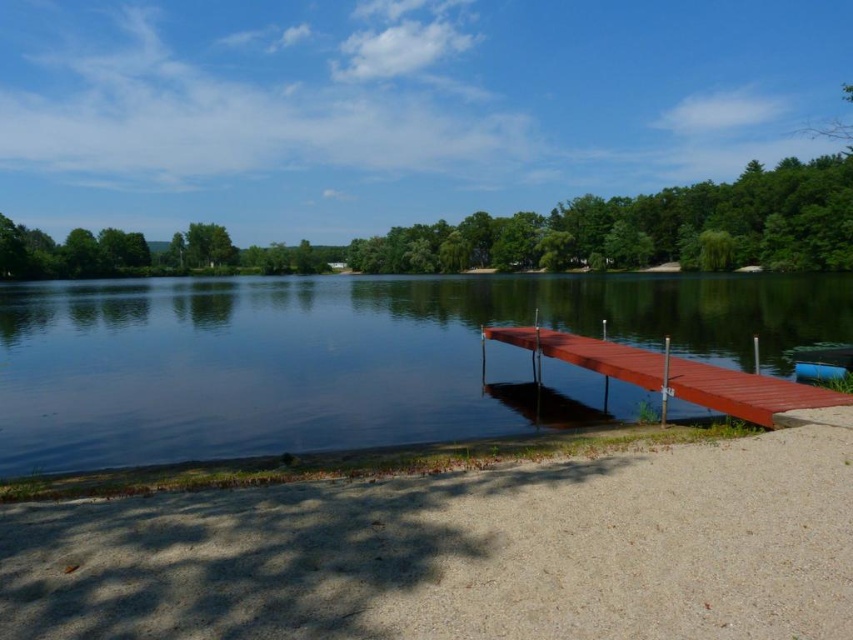
You are planning to place a small picnic basket on the smooth wood dock at lower right and the blue plastic boat at lower right. Which surface can accommodate the picnic basket more comfortably?

The smooth wood dock at lower right has a larger size compared to the blue plastic boat at lower right, so the picnic basket can be placed more comfortably on the smooth wood dock at lower right.